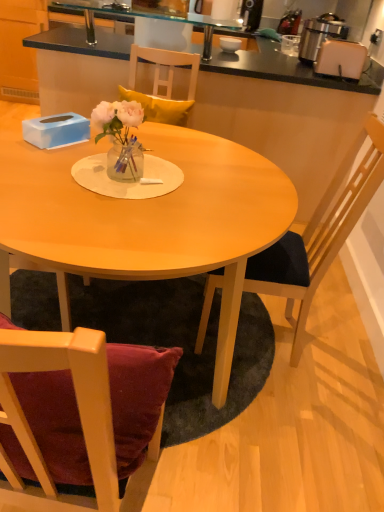
Find the location of a particular element. free space to the left of clear glass vase at center is located at coordinates (68, 165).